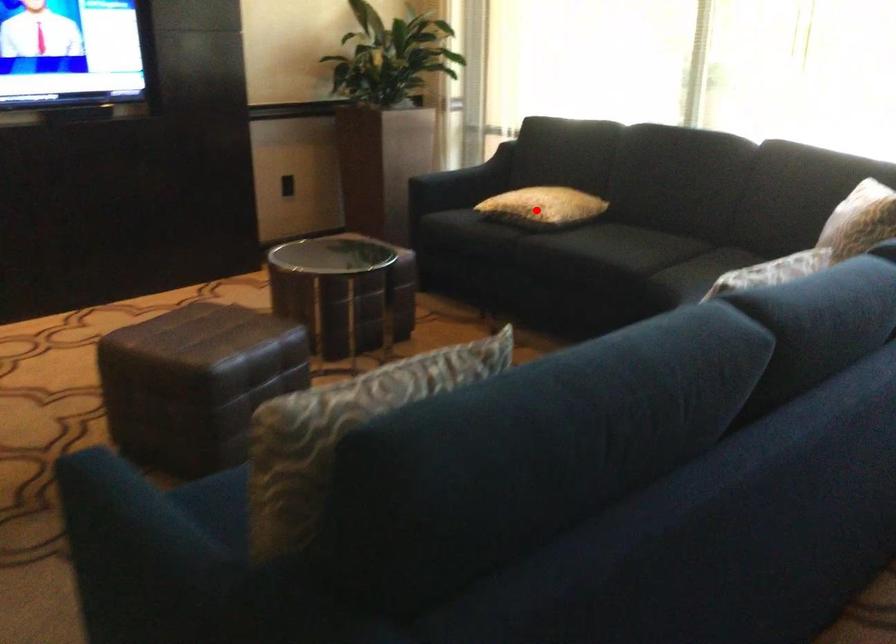
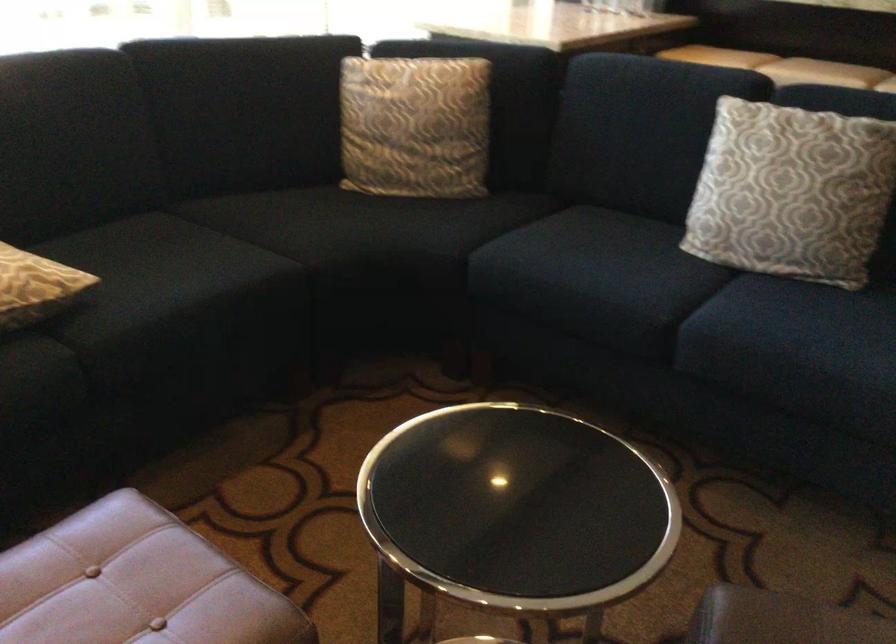
Question: A red point is marked in image1. In image2, is the corresponding 3D point closer to the camera or farther? Reply with the corresponding letter.

Choices:
 (A) The corresponding 3D point is closer.
 (B) The corresponding 3D point is farther.

Answer: (A)